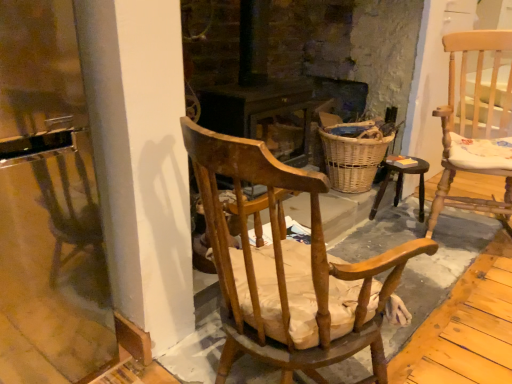
Question: In the image, is wooden stool at center positioned in front of or behind woven wicker basket at center?

Choices:
 (A) front
 (B) behind

Answer: (B)

Question: Considering the positions of point (396, 198) and point (334, 137), is point (396, 198) closer or farther from the camera than point (334, 137)?

Choices:
 (A) closer
 (B) farther

Answer: (B)

Question: Which object is the farthest from the woven wicker basket at center?

Choices:
 (A) light wood cushioned chair at right, arranged as the 1th chair when viewed from the right
 (B) wooden chair with cushion at center, which appears as the second chair when viewed from the back
 (C) wooden stool at center

Answer: (B)

Question: Which of these objects is positioned farthest from the light wood cushioned chair at right, the second chair viewed from the front?

Choices:
 (A) wooden chair with cushion at center, the first chair viewed from the left
 (B) wooden stool at center
 (C) woven wicker basket at center

Answer: (A)